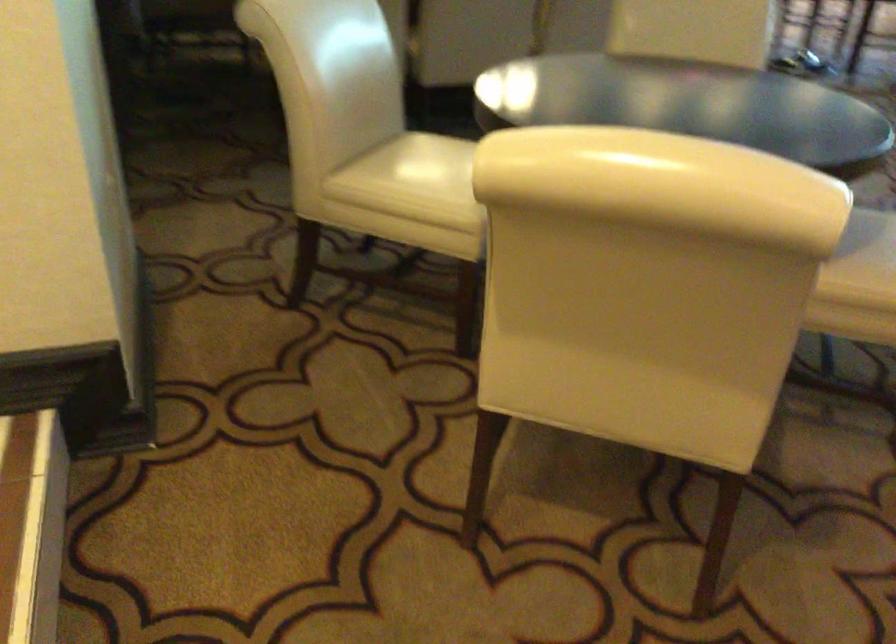
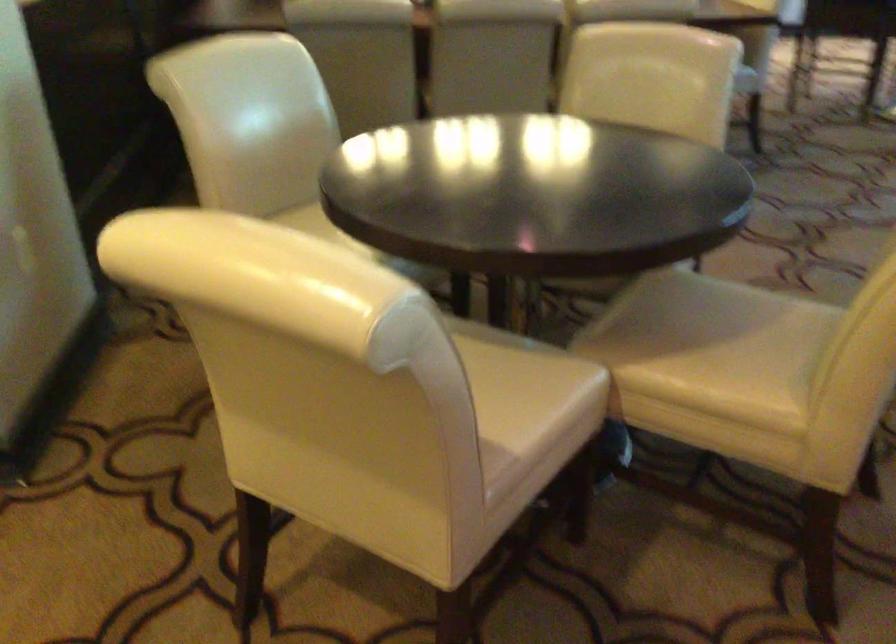
Question: How did the camera likely rotate?

Choices:
 (A) Left
 (B) Right
 (C) Up
 (D) Down

Answer: (A)